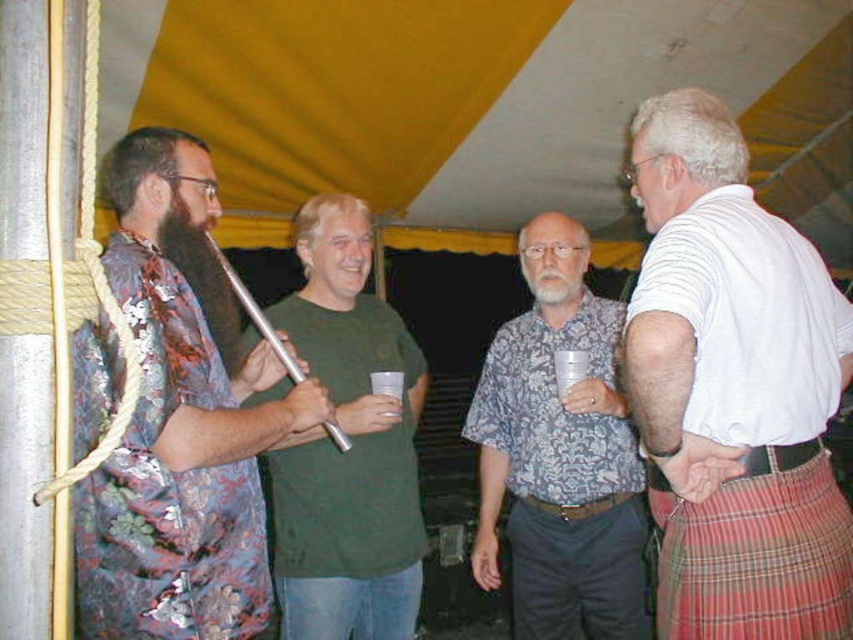
You are a photographer setting up a camera to capture the scene under the tent. You need to ensure that the floral fabric shirt at left and the silver metallic flute at center are both in focus. Given their widths, which object requires a wider aperture setting to maintain focus? Please explain your reasoning based on their sizes.

The floral fabric shirt at left is wider than the silver metallic flute at center. A wider aperture allows for a shallower depth of field, which would require focusing on the wider object to keep both in focus. However, since the shirt is wider, a wider aperture might make it harder to keep both in focus due to its larger size. Alternatively, a narrower aperture provides a deeper depth of field, better for capturing both objects clearly. The question seems to conflate aperture size with object size. To keep